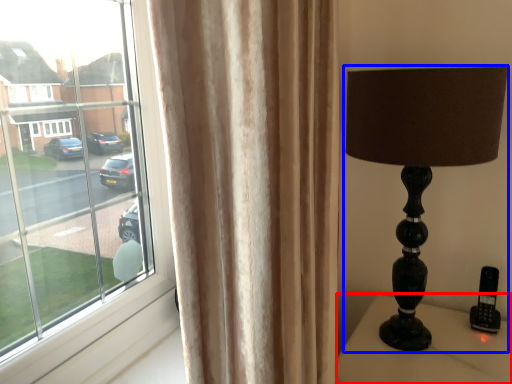
Question: Among these objects, which one is nearest to the camera, furniture (highlighted by a red box) or lamp (highlighted by a blue box)?

Choices:
 (A) furniture
 (B) lamp

Answer: (B)